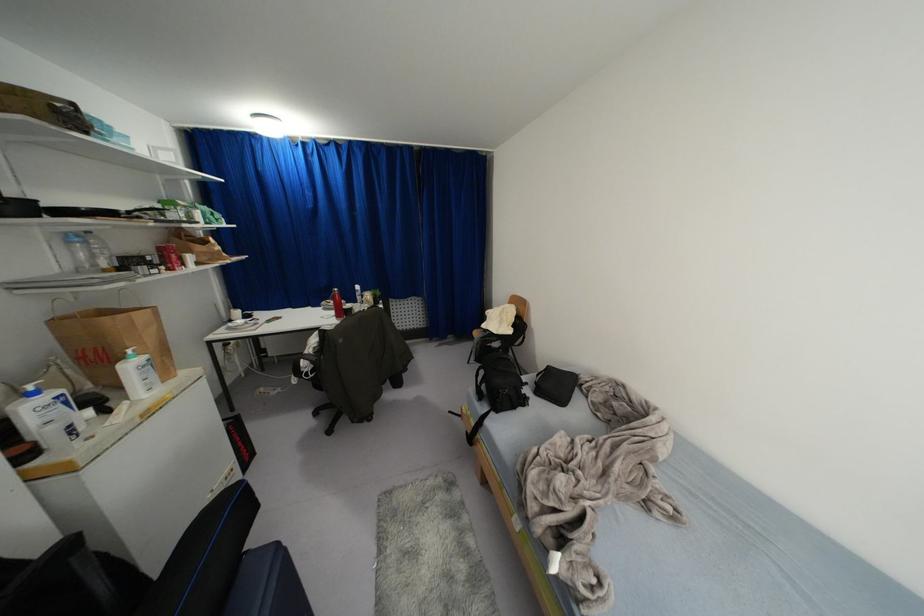
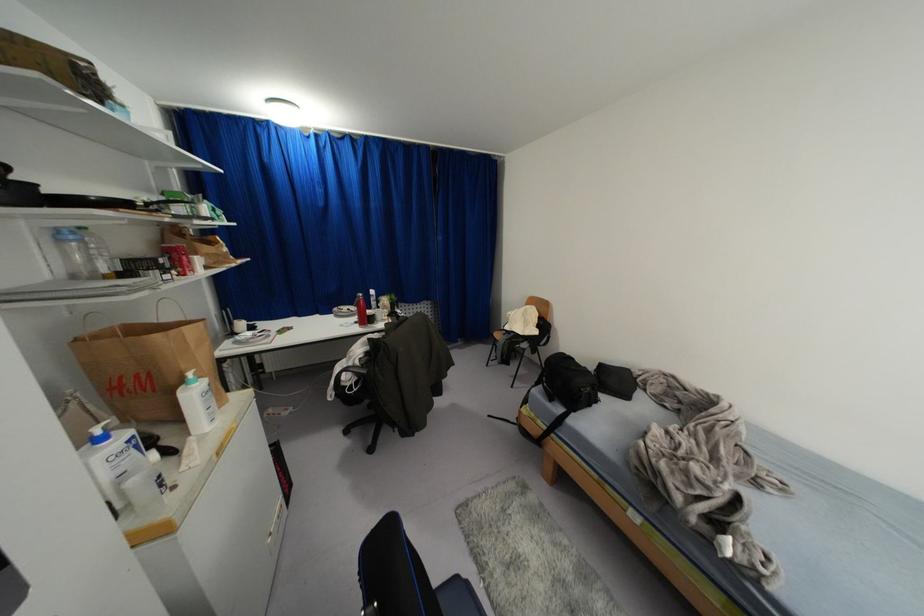
Question: What movement of the cameraman would produce the second image?

Choices:
 (A) Left
 (B) Right
 (C) Forward
 (D) Backward

Answer: (A)